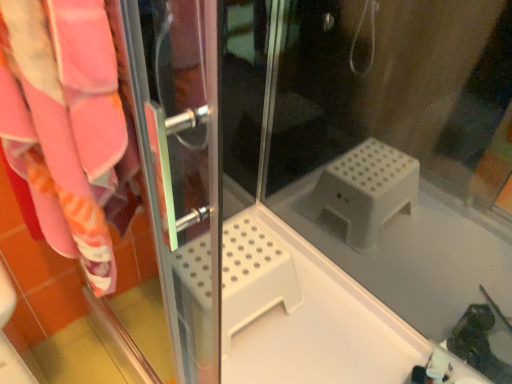
Question: Considering the relative sizes of transparent plastic step stool at center and transparent plastic screen door at left in the image provided, is transparent plastic step stool at center bigger than transparent plastic screen door at left?

Choices:
 (A) yes
 (B) no

Answer: (A)

Question: Is transparent plastic step stool at center smaller than transparent plastic screen door at left?

Choices:
 (A) no
 (B) yes

Answer: (A)

Question: From the image's perspective, is transparent plastic step stool at center under transparent plastic screen door at left?

Choices:
 (A) no
 (B) yes

Answer: (A)

Question: Does transparent plastic step stool at center have a lesser height compared to transparent plastic screen door at left?

Choices:
 (A) no
 (B) yes

Answer: (A)

Question: Would you consider transparent plastic step stool at center to be distant from transparent plastic screen door at left?

Choices:
 (A) no
 (B) yes

Answer: (A)

Question: Can you confirm if transparent plastic step stool at center is wider than transparent plastic screen door at left?

Choices:
 (A) no
 (B) yes

Answer: (B)

Question: Are transparent plastic screen door at left and transparent plastic step stool at center far apart?

Choices:
 (A) yes
 (B) no

Answer: (B)

Question: From a real-world perspective, is transparent plastic screen door at left located higher than transparent plastic step stool at center?

Choices:
 (A) yes
 (B) no

Answer: (A)

Question: Considering the relative sizes of transparent plastic screen door at left and transparent plastic step stool at center in the image provided, is transparent plastic screen door at left wider than transparent plastic step stool at center?

Choices:
 (A) no
 (B) yes

Answer: (A)

Question: Does transparent plastic screen door at left come behind transparent plastic step stool at center?

Choices:
 (A) yes
 (B) no

Answer: (B)

Question: Is transparent plastic screen door at left to the left of transparent plastic step stool at center from the viewer's perspective?

Choices:
 (A) yes
 (B) no

Answer: (A)

Question: From the image's perspective, is transparent plastic screen door at left above transparent plastic step stool at center?

Choices:
 (A) yes
 (B) no

Answer: (B)

Question: In terms of size, does transparent plastic step stool at center appear bigger or smaller than transparent plastic screen door at left?

Choices:
 (A) big
 (B) small

Answer: (A)